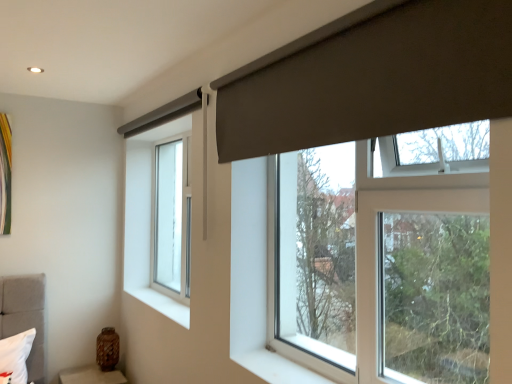
At what (x,y) coordinates should I click in order to perform the action: click on transparent glass window at center, the second window positioned from the back. Please return your answer as a coordinate pair (x, y). Image resolution: width=512 pixels, height=384 pixels. Looking at the image, I should click on (402, 211).

The width and height of the screenshot is (512, 384). What do you see at coordinates (402, 211) in the screenshot? I see `transparent glass window at center, the 1th window viewed from the front` at bounding box center [402, 211].

What do you see at coordinates (91, 376) in the screenshot? Image resolution: width=512 pixels, height=384 pixels. I see `brown textured vase at lower left` at bounding box center [91, 376].

Measure the distance between point (129,289) and camera.

The distance of point (129,289) from camera is 10.68 feet.

What are the coordinates of `matte gray curtain at upper right` in the screenshot? It's located at (371, 78).

Is transparent glass window at center, the 1th window viewed from the front, in front of or behind matte gray curtain at upper right in the image?

transparent glass window at center, the 1th window viewed from the front, is positioned farther from the viewer than matte gray curtain at upper right.

Considering the sizes of objects transparent glass window at center, acting as the second window starting from the left, and matte gray curtain at upper right in the image provided, who is wider, transparent glass window at center, acting as the second window starting from the left, or matte gray curtain at upper right?

With larger width is transparent glass window at center, acting as the second window starting from the left.

Is transparent glass window at center, the second window positioned from the back, inside or outside of matte gray curtain at upper right?

transparent glass window at center, the second window positioned from the back, is outside matte gray curtain at upper right.

Image resolution: width=512 pixels, height=384 pixels. I want to click on curtain in front of the transparent glass window at center, acting as the second window starting from the left, so click(x=371, y=78).

Considering the sizes of brown textured vase at lower left and matte gray curtain at upper right in the image, is brown textured vase at lower left bigger or smaller than matte gray curtain at upper right?

Considering their sizes, brown textured vase at lower left takes up less space than matte gray curtain at upper right.

Between brown textured vase at lower left and matte gray curtain at upper right, which one has larger width?

brown textured vase at lower left is wider.

Is brown textured vase at lower left far away from matte gray curtain at upper right?

Indeed, brown textured vase at lower left is not near matte gray curtain at upper right.

How different are the orientations of brown textured vase at lower left and matte gray curtain at upper right in degrees?

The angular difference between brown textured vase at lower left and matte gray curtain at upper right is 88.3 degrees.

Considering the points (65, 383) and (172, 291), which point is behind, point (65, 383) or point (172, 291)?

The point (172, 291) is farther from the camera.

Can you tell me how much brown textured vase at lower left and clear glass window at center left, which appears as the first window when viewed from the back, differ in facing direction?

The facing directions of brown textured vase at lower left and clear glass window at center left, which appears as the first window when viewed from the back, are 87.2 degrees apart.

Who is smaller, brown textured vase at lower left or clear glass window at center left, the 2th window positioned from the front?

With smaller size is brown textured vase at lower left.

Is brown textured vase at lower left to the left of clear glass window at center left, the 2th window positioned from the front, from the viewer's perspective?

Correct, you'll find brown textured vase at lower left to the left of clear glass window at center left, the 2th window positioned from the front.

From the image's perspective, relative to transparent glass window at center, the 1th window viewed from the front, is matte gray curtain at upper right above or below?

matte gray curtain at upper right is above transparent glass window at center, the 1th window viewed from the front.

Could transparent glass window at center, the 1th window viewed from the front, be considered to be inside matte gray curtain at upper right?

No, transparent glass window at center, the 1th window viewed from the front, is not inside matte gray curtain at upper right.

Is point (429, 7) farther from camera compared to point (269, 272)?

No, it is in front of (269, 272).

Do you think matte gray curtain at upper right is within white smooth window sill at lower left, or outside of it?

matte gray curtain at upper right cannot be found inside white smooth window sill at lower left.

Image resolution: width=512 pixels, height=384 pixels. What are the coordinates of `curtain that is in front of the white smooth window sill at lower left` in the screenshot? It's located at (371, 78).

Is matte gray curtain at upper right in contact with white smooth window sill at lower left?

There is a gap between matte gray curtain at upper right and white smooth window sill at lower left.

Is matte gray curtain at upper right positioned behind white smooth window sill at lower left?

No, matte gray curtain at upper right is closer to the viewer.

Which of these two, white smooth window sill at lower left or clear glass window at center left, the 2th window positioned from the front, is thinner?

clear glass window at center left, the 2th window positioned from the front, is thinner.

Is white smooth window sill at lower left in contact with clear glass window at center left, the 2th window positioned from the front?

No, white smooth window sill at lower left is not touching clear glass window at center left, the 2th window positioned from the front.

Does white smooth window sill at lower left turn towards clear glass window at center left, which is the 1th window in left-to-right order?

No, white smooth window sill at lower left is not aimed at clear glass window at center left, which is the 1th window in left-to-right order.

Is white smooth window sill at lower left situated inside clear glass window at center left, which is the 1th window in left-to-right order, or outside?

white smooth window sill at lower left is outside clear glass window at center left, which is the 1th window in left-to-right order.

Is white smooth window sill at lower left at the right side of brown textured vase at lower left?

Yes.

Is white smooth window sill at lower left touching brown textured vase at lower left?

No, white smooth window sill at lower left is not making contact with brown textured vase at lower left.

Which of these two, white smooth window sill at lower left or brown textured vase at lower left, is bigger?

Bigger between the two is brown textured vase at lower left.

Looking at this image, measure the distance from white smooth window sill at lower left to brown textured vase at lower left.

white smooth window sill at lower left and brown textured vase at lower left are 73.20 centimeters apart.

Locate an element on the screen. window on the right side of matte gray curtain at upper right is located at coordinates (402, 211).

The height and width of the screenshot is (384, 512). In the image, there is a matte gray curtain at upper right. Find the location of `furniture below it (from the image's perspective)`. furniture below it (from the image's perspective) is located at coordinates (91, 376).

Estimate the real-world distances between objects in this image. Which object is closer to transparent glass window at center, which is counted as the first window, starting from the right, brown textured vase at lower left or white smooth window sill at lower left?

The object closer to transparent glass window at center, which is counted as the first window, starting from the right, is white smooth window sill at lower left.

Which object lies further to the anchor point brown textured vase at lower left, white smooth window sill at lower left or matte gray curtain at upper right?

Based on the image, matte gray curtain at upper right appears to be further to brown textured vase at lower left.

Considering their positions, is clear glass window at center left, which appears as the first window when viewed from the back, positioned further to brown textured vase at lower left than white smooth window sill at lower left?

clear glass window at center left, which appears as the first window when viewed from the back, lies further to brown textured vase at lower left than the other object.

Based on their spatial positions, is white smooth window sill at lower left or brown textured vase at lower left closer to transparent glass window at center, acting as the second window starting from the left?

The object closer to transparent glass window at center, acting as the second window starting from the left, is white smooth window sill at lower left.

When comparing their distances from matte gray curtain at upper right, does white smooth window sill at lower left or transparent glass window at center, the 1th window viewed from the front, seem closer?

The object closer to matte gray curtain at upper right is transparent glass window at center, the 1th window viewed from the front.

Which object lies nearer to the anchor point brown textured vase at lower left, white smooth window sill at lower left or transparent glass window at center, which is counted as the first window, starting from the right?

The object closer to brown textured vase at lower left is white smooth window sill at lower left.

Which object lies further to the anchor point transparent glass window at center, acting as the second window starting from the left, clear glass window at center left, which appears as the first window when viewed from the back, or matte gray curtain at upper right?

clear glass window at center left, which appears as the first window when viewed from the back, is positioned further to the anchor transparent glass window at center, acting as the second window starting from the left.

When comparing their distances from clear glass window at center left, the 2th window positioned from the front, does brown textured vase at lower left or matte gray curtain at upper right seem closer?

brown textured vase at lower left is closer to clear glass window at center left, the 2th window positioned from the front.

Where is `window between transparent glass window at center, the second window positioned from the back, and brown textured vase at lower left from front to back`? window between transparent glass window at center, the second window positioned from the back, and brown textured vase at lower left from front to back is located at coordinates (170, 220).

Locate an element on the screen. window sill between matte gray curtain at upper right and clear glass window at center left, which appears as the first window when viewed from the back, along the z-axis is located at coordinates (162, 304).

Find the location of a particular element. The height and width of the screenshot is (384, 512). window sill between transparent glass window at center, the second window positioned from the back, and clear glass window at center left, the 2th window positioned from the front, from front to back is located at coordinates (162, 304).

At what (x,y) coordinates should I click in order to perform the action: click on window located between matte gray curtain at upper right and clear glass window at center left, which is the 1th window in left-to-right order, in the depth direction. Please return your answer as a coordinate pair (x, y). The width and height of the screenshot is (512, 384). Looking at the image, I should click on (402, 211).